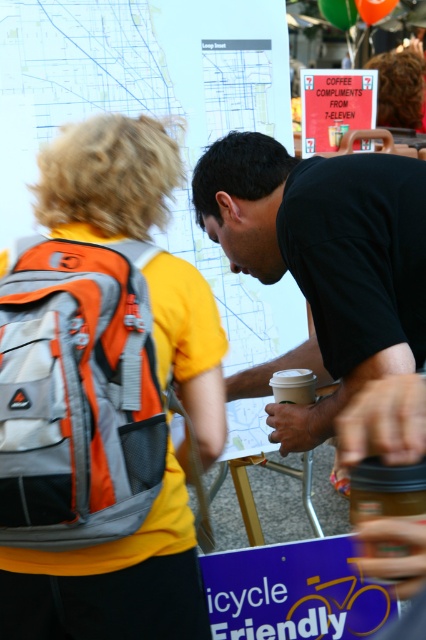
Question: Among these points, which one is nearest to the camera?

Choices:
 (A) (74, 33)
 (B) (420, 348)
 (C) (23, 394)

Answer: (C)

Question: Is orange fabric backpack at upper left positioned behind white paper map at upper left?

Choices:
 (A) yes
 (B) no

Answer: (B)

Question: Is orange fabric backpack at left positioned behind black matte shirt at center?

Choices:
 (A) no
 (B) yes

Answer: (A)

Question: Which object is farther from the camera taking this photo?

Choices:
 (A) orange fabric backpack at upper left
 (B) white paper map at upper left
 (C) white matte cup at center
 (D) orange fabric backpack at left

Answer: (B)

Question: Considering the real-world distances, which object is closest to the white matte cup at center?

Choices:
 (A) black matte shirt at center
 (B) white paper map at upper left

Answer: (A)

Question: Is white paper map at upper left to the left of white matte cup at center from the viewer's perspective?

Choices:
 (A) yes
 (B) no

Answer: (A)